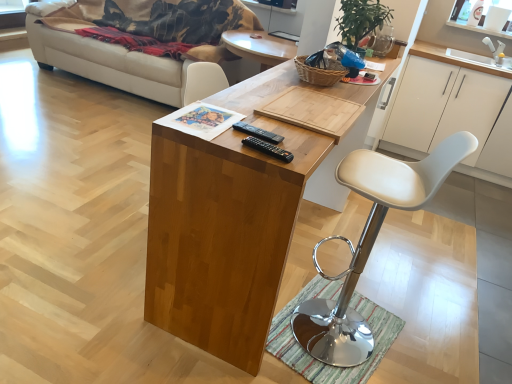
Find the location of a particular element. vacant area located to the right-hand side of black plastic remote at center, the 1th remote in the front-to-back sequence is located at coordinates (303, 152).